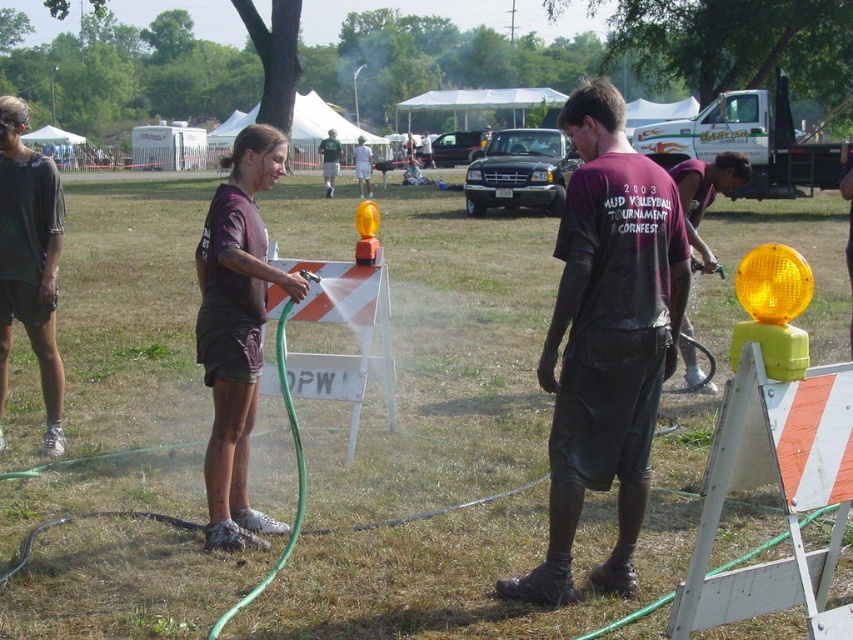
Question: Does dark brown mud at center appear on the right side of matte purple shirt at center?

Choices:
 (A) yes
 (B) no

Answer: (A)

Question: Which point appears farthest from the camera in this image?

Choices:
 (A) (4, 276)
 (B) (329, 148)
 (C) (360, 150)
 (D) (718, 184)

Answer: (C)

Question: Estimate the real-world distances between objects in this image. Which object is closer to the dark brown mud at center?

Choices:
 (A) dark brown shorts at center
 (B) light brown wooden sign at center
 (C) matte purple shirt at center

Answer: (C)

Question: Does dark gray t-shirt at left come behind matte black shirt at center?

Choices:
 (A) no
 (B) yes

Answer: (B)

Question: Is dark gray t-shirt at left positioned at the back of matte black shirt at center?

Choices:
 (A) no
 (B) yes

Answer: (B)

Question: Which is farther from the dark gray t-shirt at left?

Choices:
 (A) dark brown shorts at center
 (B) green fabric shirt at center
 (C) matte black shirt at center

Answer: (A)